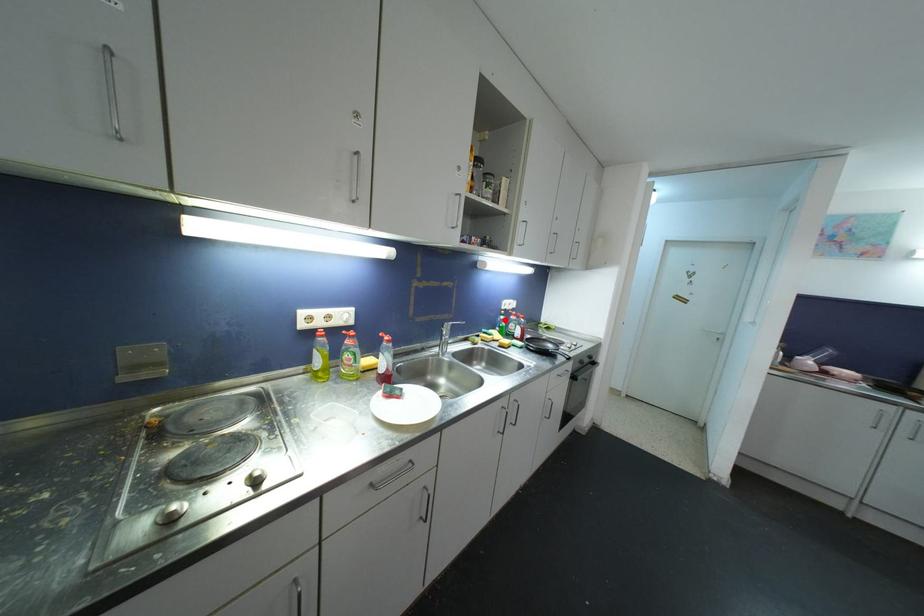
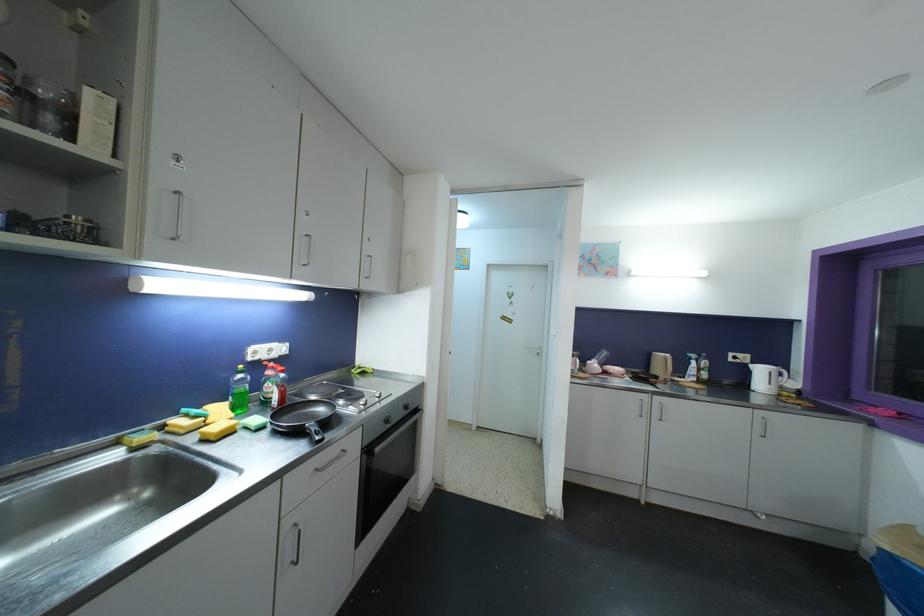
Find the pixel in the second image that matches the highlighted location in the first image.

(244, 379)